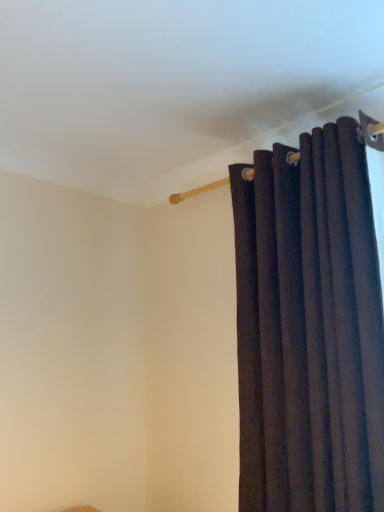
Identify the location of dark fabric curtain at upper right. This screenshot has height=512, width=384. (309, 326).

In the scene shown: What is the approximate width of dark fabric curtain at upper right?

It is 6.20 inches.

Measure the distance between point (365,206) and camera.

The distance of point (365,206) from camera is 1.23 meters.

The image size is (384, 512). Describe the element at coordinates (309, 326) in the screenshot. I see `dark fabric curtain at upper right` at that location.

Measure the distance between dark fabric curtain at upper right and camera.

3.59 feet.

What are the coordinates of `dark fabric curtain at upper right` in the screenshot? It's located at (309, 326).